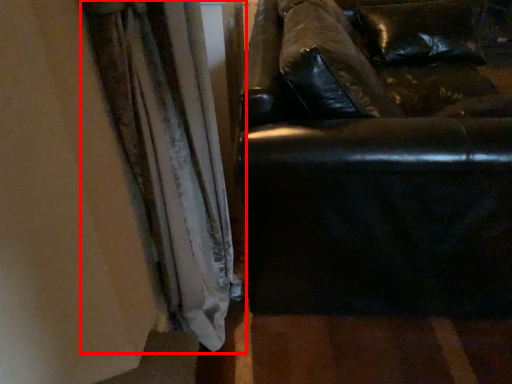
Question: From the image's perspective, what is the correct spatial relationship of curtain (annotated by the red box) in relation to studio couch?

Choices:
 (A) below
 (B) above

Answer: (A)